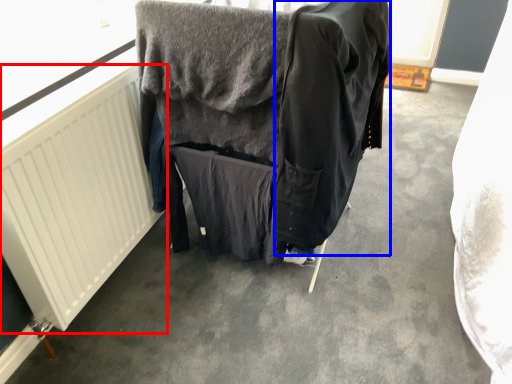
Question: Which point is further to the camera, radiator (highlighted by a red box) or clothing (highlighted by a blue box)?

Choices:
 (A) radiator
 (B) clothing

Answer: (A)